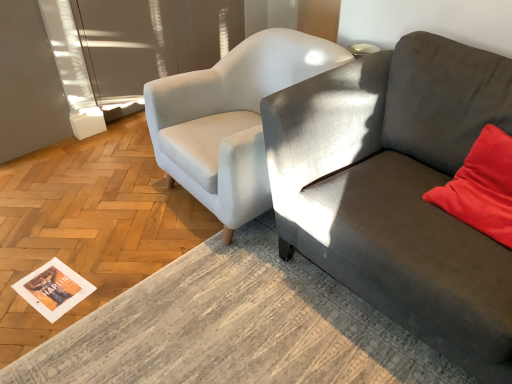
Question: Relative to textured gray couch at right, is white paper magazine at lower left in front or behind?

Choices:
 (A) behind
 (B) front

Answer: (A)

Question: Is white paper magazine at lower left situated inside textured gray couch at right or outside?

Choices:
 (A) inside
 (B) outside

Answer: (B)

Question: Which object is positioned closest to the transparent glass door at upper left?

Choices:
 (A) velvet red pillow at right
 (B) white paper magazine at lower left
 (C) textured gray couch at right
 (D) white fabric chair at center

Answer: (D)

Question: Which is farther from the white fabric chair at center?

Choices:
 (A) white paper magazine at lower left
 (B) velvet red pillow at right
 (C) transparent glass door at upper left
 (D) textured gray couch at right

Answer: (C)